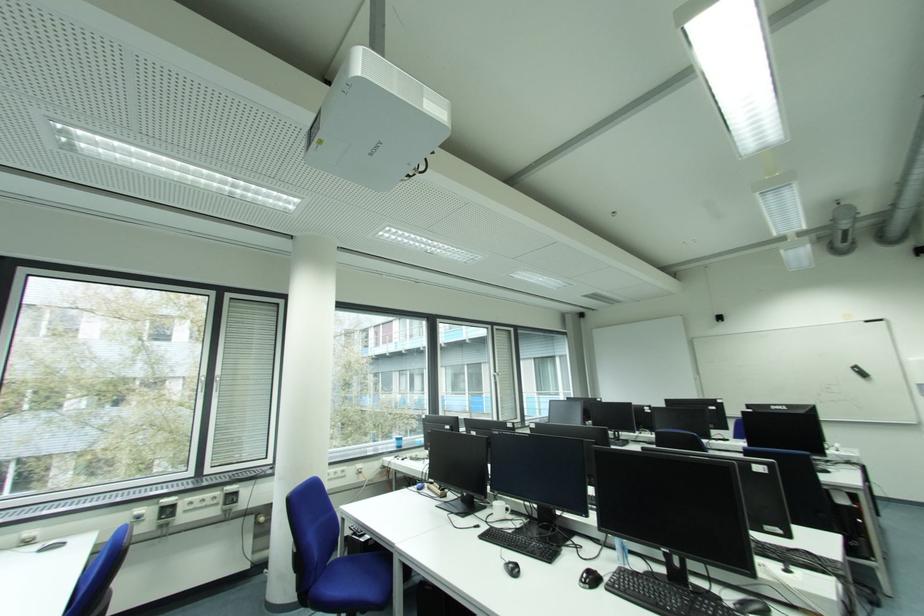
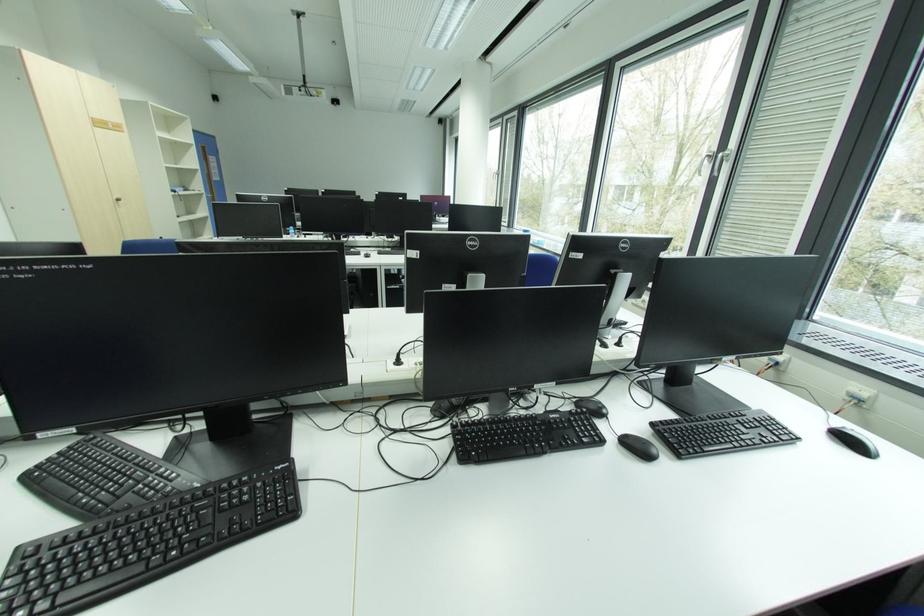
Question: I am providing you with two images of the same scene from different viewpoints. After the viewpoint changes to image2, which objects are now occluded?

Choices:
 (A) black computer mouse
 (B) round wooden seat
 (C) silver window handle
 (D) blue chair sitting surface

Answer: (A)